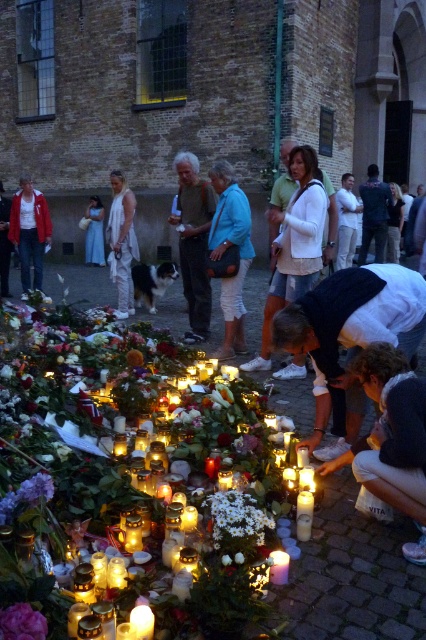
Can you confirm if matte white shirt at center is positioned to the left of white wax candle at lower center?

In fact, matte white shirt at center is to the right of white wax candle at lower center.

Is matte white shirt at center wider than white wax candle at lower center?

Yes, matte white shirt at center is wider than white wax candle at lower center.

Identify the location of matte white shirt at center. (394, 225).

What are the coordinates of `matte white shirt at center` in the screenshot? It's located at (394, 225).

Is point (397, 186) positioned behind point (143, 612)?

Yes, point (397, 186) is behind point (143, 612).

Image resolution: width=426 pixels, height=640 pixels. Describe the element at coordinates (394, 225) in the screenshot. I see `matte white shirt at center` at that location.

I want to click on matte white shirt at center, so click(394, 225).

Can you confirm if white floral bouquet at center is thinner than white matte flowers at center?

Yes.

Between white floral bouquet at center and white matte flowers at center, which one has less height?

Standing shorter between the two is white floral bouquet at center.

Between point (236, 385) and point (262, 529), which one is positioned in front?

Point (262, 529) is in front.

Locate an element on the screen. The width and height of the screenshot is (426, 640). white floral bouquet at center is located at coordinates (69, 445).